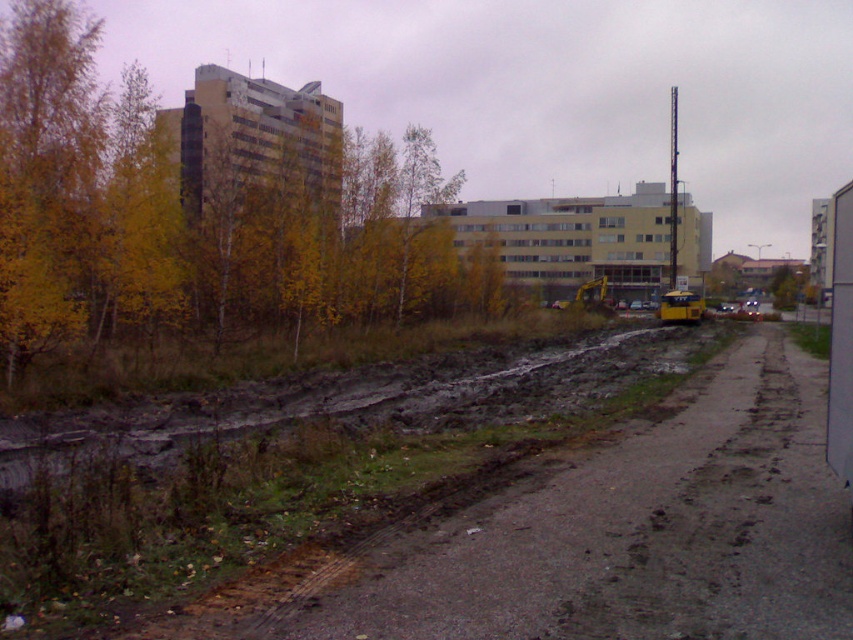
You are a pedestrian walking along the muddy asphalt at lower left and want to reach the yellow leafy trees at upper left. Which direction should you head towards to get there?

The yellow leafy trees at upper left are positioned on the left side of muddy asphalt at lower left, so you should head towards the left direction to reach them.

You are standing at the bottom left of the image and want to walk towards the point labeled point (755, 577). Which direction should you turn to face the point labeled point (10, 227)?

To face the point labeled point (10, 227) from your current position at the bottom left, you should turn to your right. This is because point (10, 227) is located closer to the viewer compared to point (755, 577), which is further away in the background.